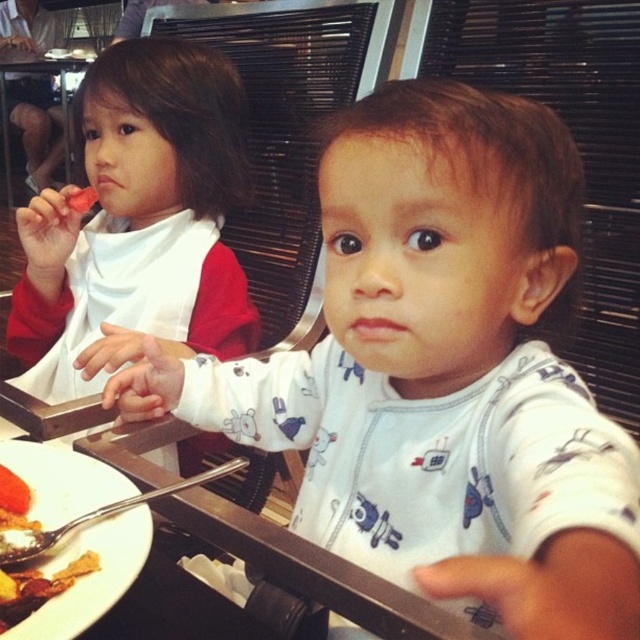
Is white matte bib at upper left thinner than soft yellow bread at lower left?

Incorrect, white matte bib at upper left's width is not less than soft yellow bread at lower left's.

Who is higher up, white matte bib at upper left or soft yellow bread at lower left?

white matte bib at upper left is higher up.

Is point (17, 349) closer to viewer compared to point (33, 604)?

No, (17, 349) is further to viewer.

You are a GUI agent. You are given a task and a screenshot of the screen. Output one action in this format:
    pyautogui.click(x=<x>, y=<y>)
    Task: Click on the white matte bib at upper left
    This screenshot has height=640, width=640.
    Given the screenshot: What is the action you would take?
    pyautogui.click(x=138, y=225)